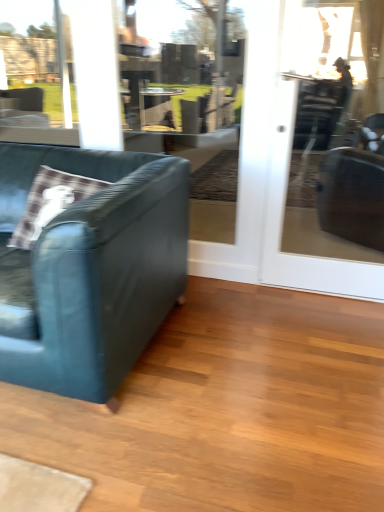
What are the coordinates of `transparent glass screen door at center` in the screenshot? It's located at (282, 226).

What do you see at coordinates (282, 226) in the screenshot?
I see `transparent glass screen door at center` at bounding box center [282, 226].

I want to click on velvet teal couch at left, so click(89, 268).

The height and width of the screenshot is (512, 384). Describe the element at coordinates (89, 268) in the screenshot. I see `velvet teal couch at left` at that location.

You are a GUI agent. You are given a task and a screenshot of the screen. Output one action in this format:
    pyautogui.click(x=<x>, y=<y>)
    Task: Click on the transparent glass screen door at center
    The image size is (384, 512).
    Given the screenshot: What is the action you would take?
    pyautogui.click(x=282, y=226)

Between transparent glass screen door at center and velvet teal couch at left, which one appears on the left side from the viewer's perspective?

velvet teal couch at left is more to the left.

Is transparent glass screen door at center behind velvet teal couch at left?

Yes, it is.

Considering the positions of point (313, 283) and point (148, 186), is point (313, 283) closer or farther from the camera than point (148, 186)?

Point (313, 283) is farther from the camera than point (148, 186).

From the image's perspective, who appears lower, transparent glass screen door at center or velvet teal couch at left?

velvet teal couch at left is shown below in the image.

From a real-world perspective, does transparent glass screen door at center sit lower than velvet teal couch at left?

No, from a real-world perspective, transparent glass screen door at center is not beneath velvet teal couch at left.

Does transparent glass screen door at center have a lesser width compared to velvet teal couch at left?

Yes.

Is transparent glass screen door at center taller than velvet teal couch at left?

Indeed, transparent glass screen door at center has a greater height compared to velvet teal couch at left.

Considering the sizes of transparent glass screen door at center and velvet teal couch at left in the image, is transparent glass screen door at center bigger or smaller than velvet teal couch at left?

In the image, transparent glass screen door at center appears to be smaller than velvet teal couch at left.

Looking at this image, could velvet teal couch at left be considered to be inside transparent glass screen door at center?

No.

Is transparent glass screen door at center directly adjacent to velvet teal couch at left?

No, transparent glass screen door at center is not making contact with velvet teal couch at left.

Is transparent glass screen door at center facing towards velvet teal couch at left?

No, transparent glass screen door at center is not facing towards velvet teal couch at left.

What's the angular difference between transparent glass screen door at center and velvet teal couch at left's facing directions?

0.0612 degrees.

Find the location of a particular element. The width and height of the screenshot is (384, 512). screen door above the velvet teal couch at left (from the image's perspective) is located at coordinates (282, 226).

Can you confirm if velvet teal couch at left is positioned to the left of transparent glass screen door at center?

Yes, velvet teal couch at left is to the left of transparent glass screen door at center.

Considering the positions of objects velvet teal couch at left and transparent glass screen door at center in the image provided, who is in front, velvet teal couch at left or transparent glass screen door at center?

velvet teal couch at left is in front.

Which is closer to the camera, (181,186) or (267,219)?

Point (181,186)

From the image's perspective, is velvet teal couch at left located above transparent glass screen door at center?

Actually, velvet teal couch at left appears below transparent glass screen door at center in the image.

From a real-world perspective, is velvet teal couch at left over transparent glass screen door at center?

Incorrect, from a real-world perspective, velvet teal couch at left is lower than transparent glass screen door at center.

Is velvet teal couch at left wider than transparent glass screen door at center?

Yes, velvet teal couch at left is wider than transparent glass screen door at center.

Between velvet teal couch at left and transparent glass screen door at center, which one has more height?

Standing taller between the two is transparent glass screen door at center.

Does velvet teal couch at left have a larger size compared to transparent glass screen door at center?

Correct, velvet teal couch at left is larger in size than transparent glass screen door at center.

Would you say velvet teal couch at left is inside or outside transparent glass screen door at center?

velvet teal couch at left lies outside transparent glass screen door at center.

Are velvet teal couch at left and transparent glass screen door at center far apart?

That's not correct — velvet teal couch at left is a little close to transparent glass screen door at center.

Is velvet teal couch at left facing away from transparent glass screen door at center?

No, transparent glass screen door at center is not at the back of velvet teal couch at left.

How many degrees apart are the facing directions of velvet teal couch at left and transparent glass screen door at center?

There is a 0.0612-degree angle between the facing directions of velvet teal couch at left and transparent glass screen door at center.

Identify the location of screen door above the velvet teal couch at left (from the image's perspective). Image resolution: width=384 pixels, height=512 pixels. (282, 226).

At what (x,y) coordinates should I click in order to perform the action: click on studio couch on the left of transparent glass screen door at center. Please return your answer as a coordinate pair (x, y). This screenshot has width=384, height=512. Looking at the image, I should click on (89, 268).

Identify the location of studio couch lying in front of the transparent glass screen door at center. (89, 268).